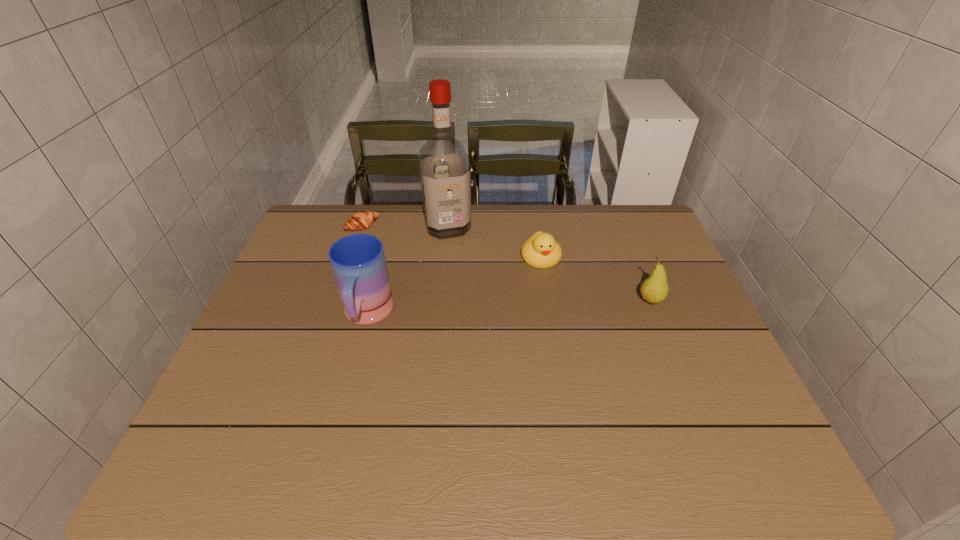
This screenshot has width=960, height=540. Identify the location of free location located on the front-facing side of the third object from right to left. (460, 265).

Locate an element on the screen. The image size is (960, 540). vacant area situated on the front-facing side of the third object from right to left is located at coordinates (472, 305).

Locate an element on the screen. The height and width of the screenshot is (540, 960). vacant area located on the front-facing side of the third object from right to left is located at coordinates (462, 269).

The image size is (960, 540). Identify the location of vacant position located on the front-facing side of the shortest object. (408, 261).

I want to click on vacant space positioned on the front-facing side of the shortest object, so click(x=444, y=290).

Find the location of a particular element. free space located on the front-facing side of the shortest object is located at coordinates (400, 255).

Where is `free spot located on the face of the third nearest object`? This screenshot has width=960, height=540. free spot located on the face of the third nearest object is located at coordinates (547, 284).

This screenshot has width=960, height=540. In order to click on vacant space located on the face of the third nearest object in this screenshot , I will do `click(558, 329)`.

Locate an element on the screen. blank area located on the face of the third nearest object is located at coordinates (560, 335).

You are a GUI agent. You are given a task and a screenshot of the screen. Output one action in this format:
    pyautogui.click(x=<x>, y=<y>)
    Task: Click on the liquor present at the far edge
    The image size is (960, 540).
    Given the screenshot: What is the action you would take?
    pyautogui.click(x=445, y=175)